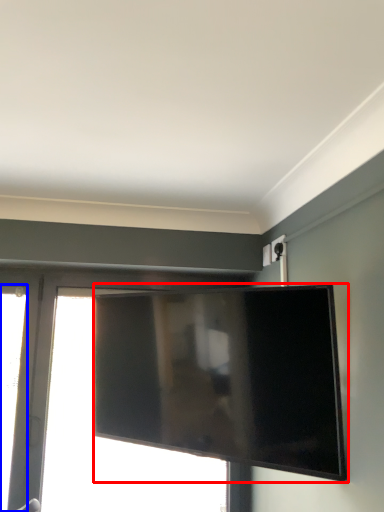
Question: Which point is further to the camera, television (highlighted by a red box) or window (highlighted by a blue box)?

Choices:
 (A) television
 (B) window

Answer: (B)